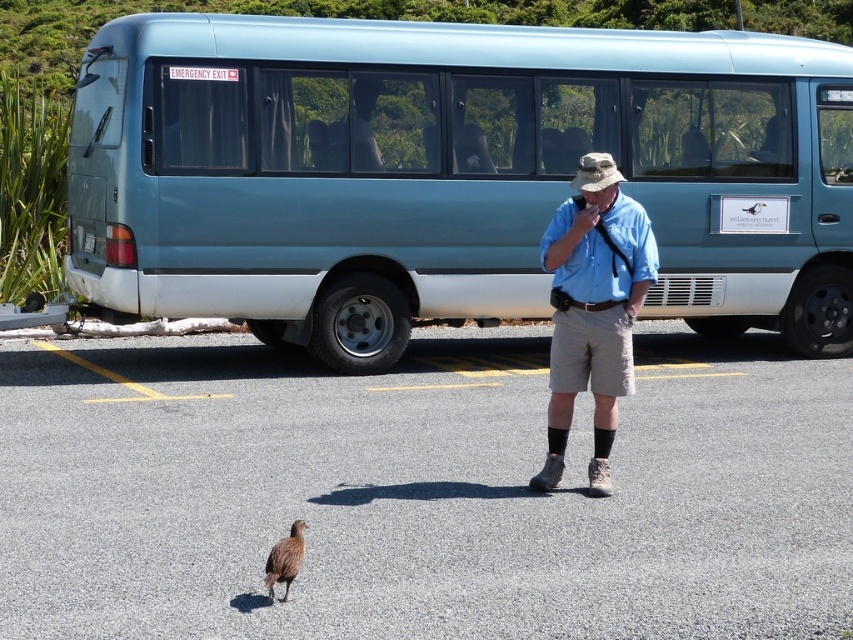
You are a photographer trying to capture the teal matte bus at upper center and the blue cotton shirt at center in the same frame. Based on their sizes in the image, which object should you focus on first to ensure both are in focus?

The teal matte bus at upper center occupies less space than the blue cotton shirt at center, so you should focus on the blue cotton shirt at center first since it is larger and will be easier to capture clearly.

You are a drone operator trying to capture aerial footage of the gray asphalt parking lot at center and the brown feathered bird at lower center. Your drone has a minimum safe altitude of 3 meters to avoid disturbing the bird. Can you fly your drone above the bird without violating the safety distance?

The gray asphalt parking lot at center is 2.32 meters from the brown feathered bird at lower center. Since the drone needs to stay at least 3 meters away to avoid disturbing the bird, flying at the minimum safe altitude of 3 meters would mean the drone is still 0.68 meters closer than required. Therefore, you need to increase the altitude to at least 3 meters above the bird to comply with the safety guidelines.